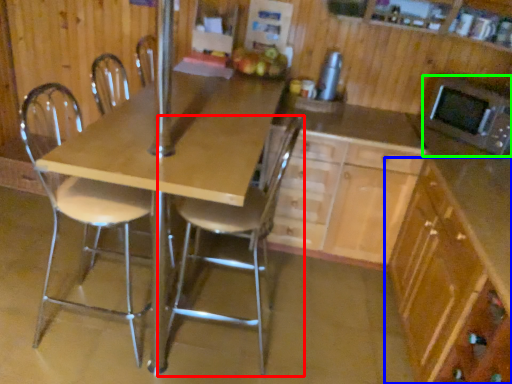
Question: Estimate the real-world distances between objects in this image. Which object is closer to chair (highlighted by a red box), cabinetry (highlighted by a blue box) or microwave oven (highlighted by a green box)?

Choices:
 (A) cabinetry
 (B) microwave oven

Answer: (A)